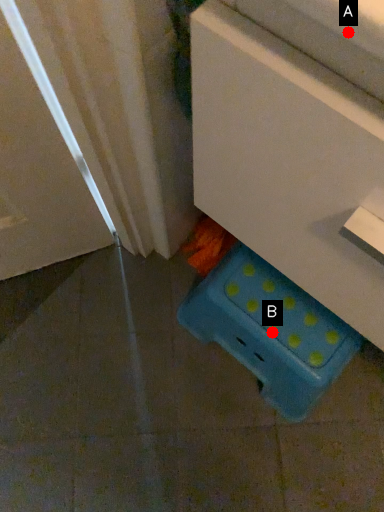
Question: Two points are circled on the image, labeled by A and B beside each circle. Which of the following is the closest to the observer?

Choices:
 (A) A is closer
 (B) B is closer

Answer: (A)